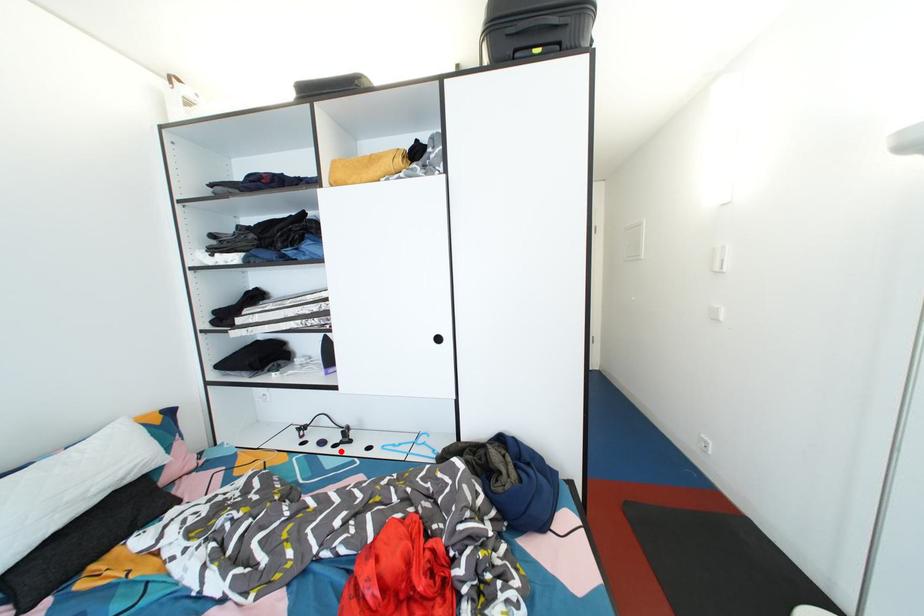
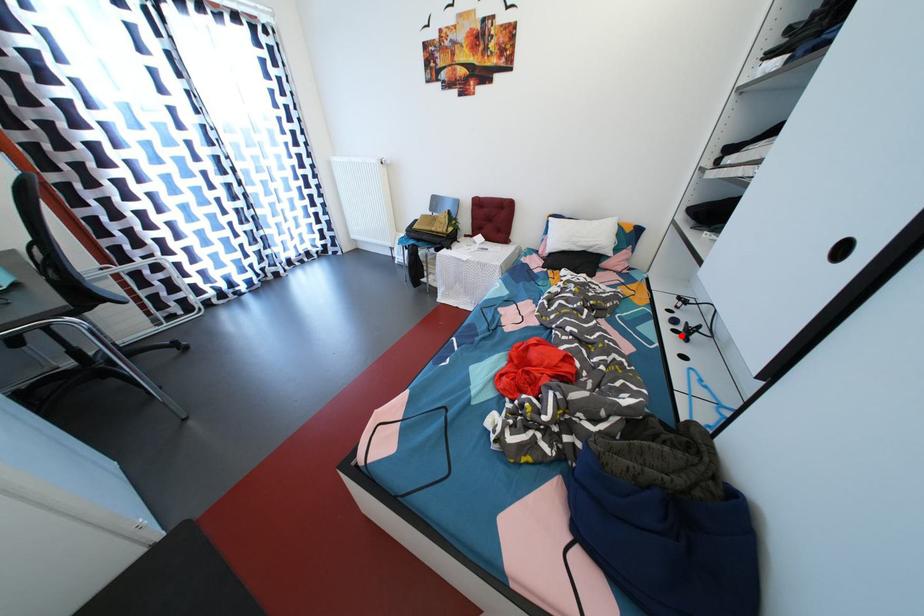
I am providing you with two images of the same scene from different viewpoints. A red point is marked on the first image and another point is marked on the second image. Does the point marked in image1 correspond to the same location as the one in image2?

Yes